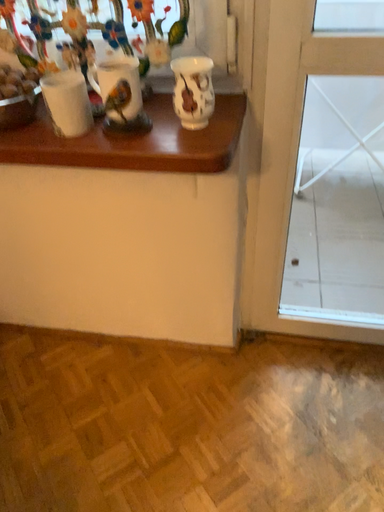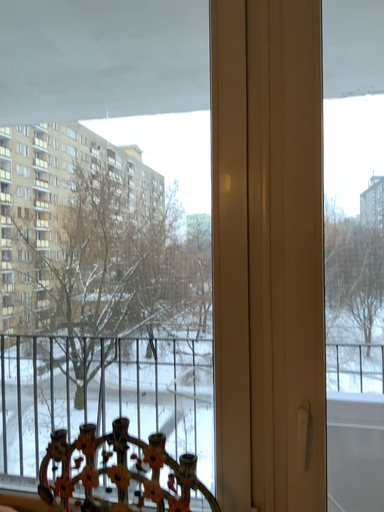
Question: How did the camera likely rotate when shooting the video?

Choices:
 (A) rotated upward
 (B) rotated downward

Answer: (A)